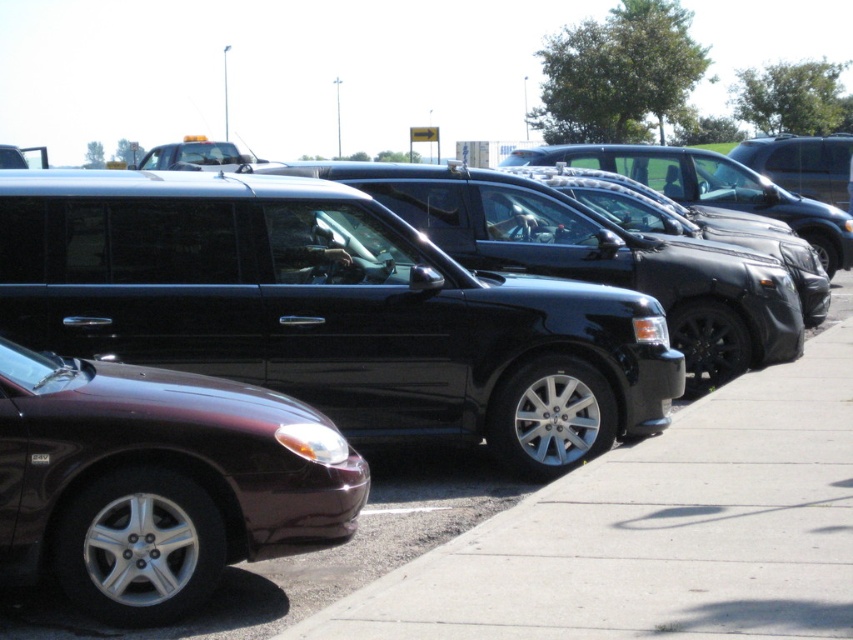
Question: Which object appears closest to the camera in this image?

Choices:
 (A) black asphalt pavement at center
 (B) shiny maroon sedan at lower left

Answer: (A)

Question: Is shiny maroon sedan at lower left in front of black asphalt pavement at center?

Choices:
 (A) no
 (B) yes

Answer: (A)

Question: Observing the image, what is the correct spatial positioning of shiny maroon sedan at lower left in reference to black asphalt pavement at center?

Choices:
 (A) above
 (B) below

Answer: (A)

Question: Can you confirm if shiny maroon sedan at lower left is wider than black asphalt pavement at center?

Choices:
 (A) yes
 (B) no

Answer: (B)

Question: Which point is farther to the camera?

Choices:
 (A) (83, 387)
 (B) (461, 458)

Answer: (B)